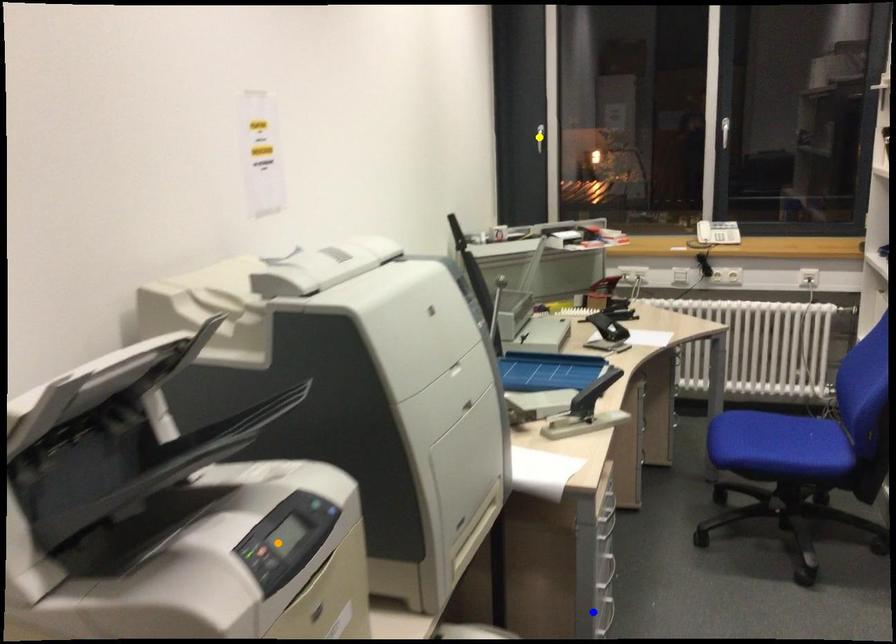
Order these from nearest to farthest:
orange point, yellow point, blue point

orange point < blue point < yellow point